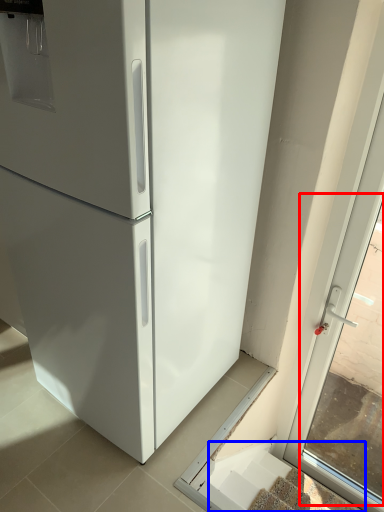
Question: Which of the following is the closest to the observer, window (highlighted by a red box) or stairs (highlighted by a blue box)?

Choices:
 (A) window
 (B) stairs

Answer: (A)